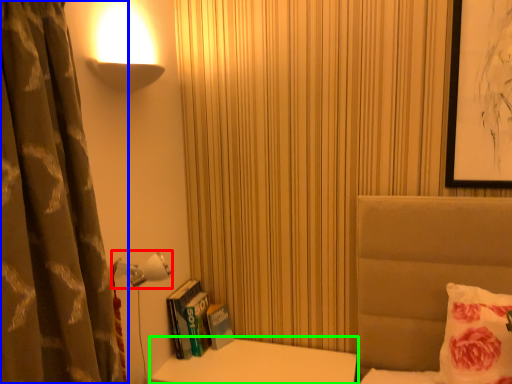
Question: Which object is the closest to the lamp (highlighted by a red box)? Choose among these: curtain (highlighted by a blue box) or table (highlighted by a green box).

Choices:
 (A) curtain
 (B) table

Answer: (A)